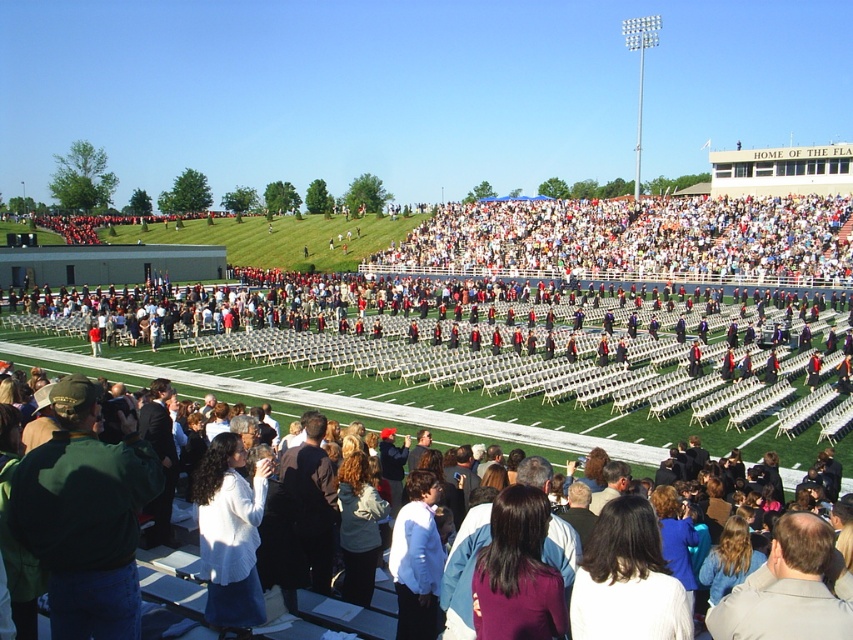
You are a photographer standing at the edge of the field and want to capture a photo of the white plastic chairs at upper center and the white fabric at center. Which object should you focus on first if you want to ensure both are in focus without adjusting your camera settings?

The white plastic chairs at upper center has a greater height compared to the white fabric at center, so you should focus on the white plastic chairs at upper center first since it is farther away. This way, the depth of field will include both objects.

You are standing at the edge of the football field in the stadium and want to reach a specific point marked at coordinates point (798, 228). If your maximum walking distance is 100 meters, can you reach that point without exceeding your limit?

The distance of point (798, 228) from viewer is 91.19 meters, so yes, you can reach it since it is within your 100 meters limit.